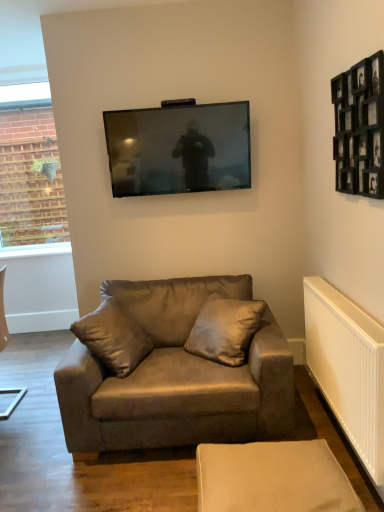
Locate an element on the screen. The height and width of the screenshot is (512, 384). free space to the left of beige fabric ottoman at lower center is located at coordinates (153, 480).